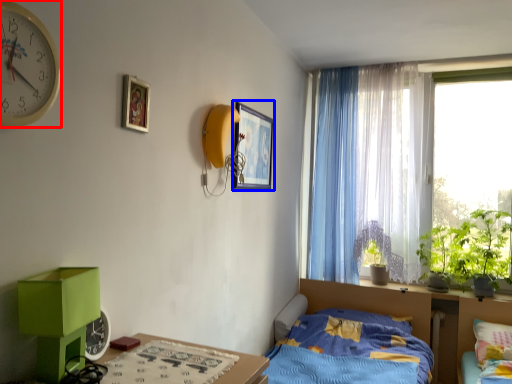
Question: Among these objects, which one is nearest to the camera, clock (highlighted by a red box) or picture frame (highlighted by a blue box)?

Choices:
 (A) clock
 (B) picture frame

Answer: (A)